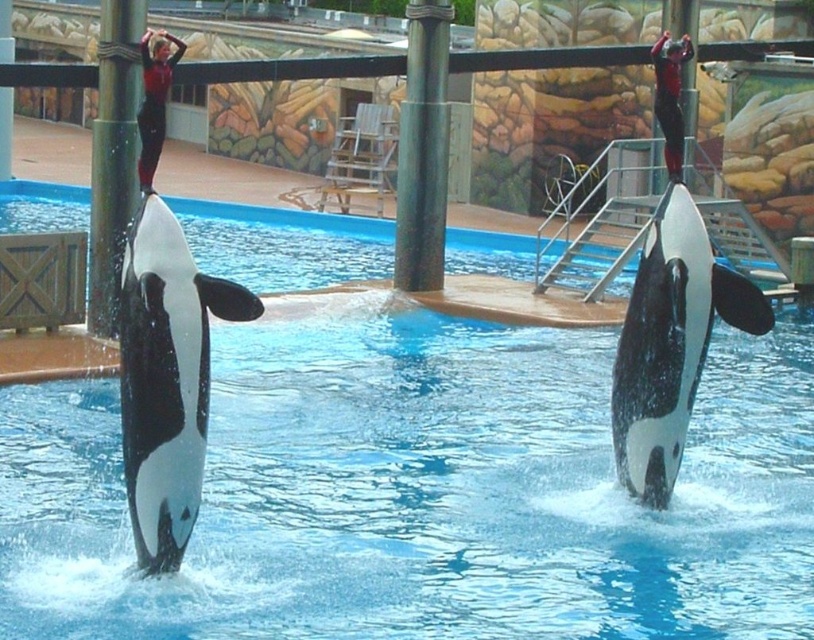
Question: Is blue smooth water at center below black/white smooth whale at center?

Choices:
 (A) no
 (B) yes

Answer: (A)

Question: Is black/white smooth whale at center closer to the viewer compared to black/white smooth orca at right?

Choices:
 (A) yes
 (B) no

Answer: (A)

Question: Which point is closer to the camera?

Choices:
 (A) green polished wood pole at center
 (B) blue smooth water at center
 (C) black/white smooth whale at center

Answer: (C)

Question: Which is farther from the black/white smooth whale at center?

Choices:
 (A) green polished wood pole at center
 (B) black matte pole at left
 (C) blue smooth water at center

Answer: (A)

Question: Can you confirm if blue smooth water at center is positioned to the left of black/white smooth whale at center?

Choices:
 (A) yes
 (B) no

Answer: (B)

Question: Which object appears farthest from the camera in this image?

Choices:
 (A) green polished wood pole at center
 (B) blue smooth water at center

Answer: (A)